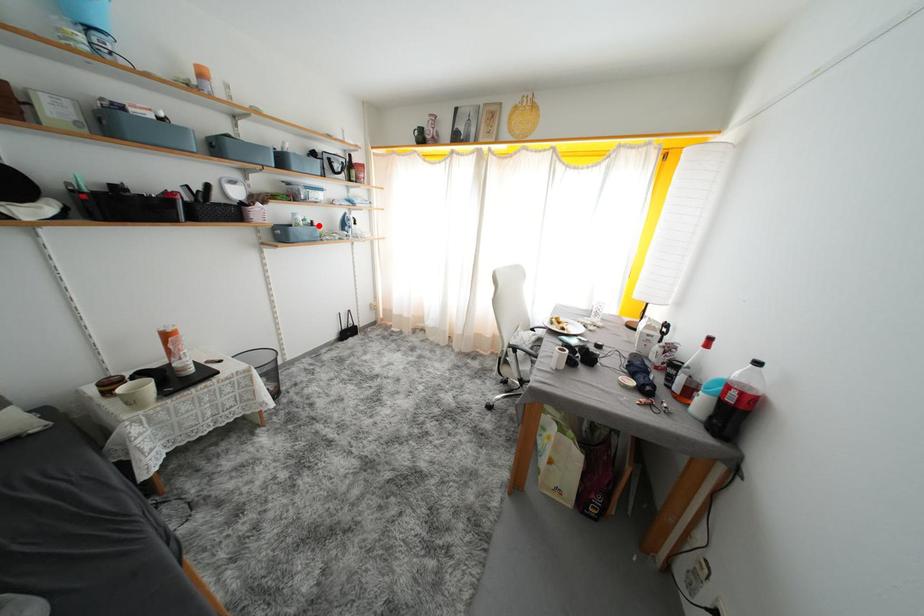
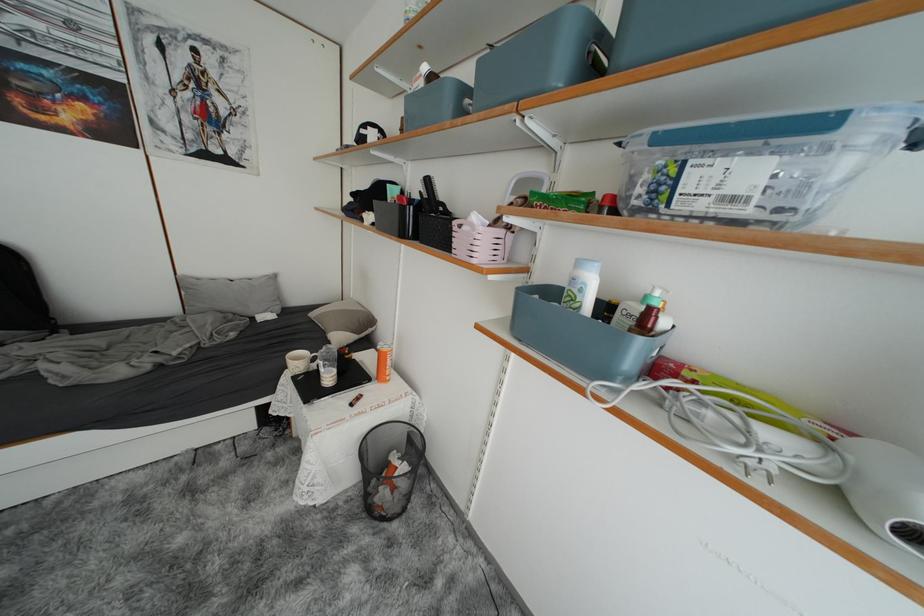
Question: A red point is marked in image1. In image2, is the corresponding 3D point closer to the camera or farther? Reply with the corresponding letter.

Choices:
 (A) The corresponding 3D point is closer.
 (B) The corresponding 3D point is farther.

Answer: (B)